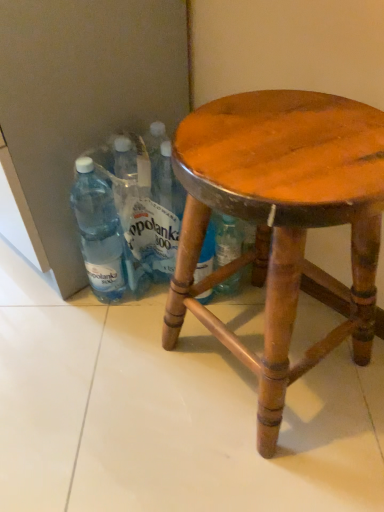
What do you see at coordinates (122, 218) in the screenshot? I see `transparent plastic bottles at lower left` at bounding box center [122, 218].

Measure the distance between wooden stool at center and camera.

They are 16.92 inches apart.

What do you see at coordinates (98, 231) in the screenshot?
I see `transparent plastic bottle at left` at bounding box center [98, 231].

What are the coordinates of `transparent plastic bottles at lower left` in the screenshot? It's located at (122, 218).

Considering the positions of objects transparent plastic bottle at left and wooden stool at center in the image provided, who is more to the left, transparent plastic bottle at left or wooden stool at center?

transparent plastic bottle at left is more to the left.

From a real-world perspective, who is located higher, transparent plastic bottle at left or wooden stool at center?

From a 3D spatial view, wooden stool at center is above.

Based on the photo, can we say transparent plastic bottle at left lies outside wooden stool at center?

Yes, transparent plastic bottle at left is not within wooden stool at center.

Is transparent plastic bottles at lower left outside of transparent plastic bottle at left?

Indeed, transparent plastic bottles at lower left is completely outside transparent plastic bottle at left.

You are a GUI agent. You are given a task and a screenshot of the screen. Output one action in this format:
    pyautogui.click(x=<x>, y=<y>)
    Task: Click on the beverage that appears below the transparent plastic bottle at left (from a real-world perspective)
    The height and width of the screenshot is (512, 384).
    Given the screenshot: What is the action you would take?
    pyautogui.click(x=122, y=218)

Are transparent plastic bottles at lower left and transparent plastic bottle at left beside each other?

Yes.

Is point (116, 145) positioned behind point (87, 205)?

That is False.

From the image's perspective, is wooden stool at center located above or below transparent plastic bottle at left?

From the image's perspective, wooden stool at center appears below transparent plastic bottle at left.

Can you confirm if wooden stool at center is positioned to the left of transparent plastic bottle at left?

Incorrect, wooden stool at center is not on the left side of transparent plastic bottle at left.

Are wooden stool at center and transparent plastic bottle at left located far from each other?

They are positioned close to each other.

How much distance is there between wooden stool at center and transparent plastic bottle at left?

13.17 inches.

Is transparent plastic bottles at lower left wider or thinner than wooden stool at center?

Considering their sizes, transparent plastic bottles at lower left looks slimmer than wooden stool at center.

Considering the relative sizes of transparent plastic bottles at lower left and wooden stool at center in the image provided, is transparent plastic bottles at lower left smaller than wooden stool at center?

Indeed, transparent plastic bottles at lower left has a smaller size compared to wooden stool at center.

In the scene shown: From a real-world perspective, which object stands above the other?

wooden stool at center.

Is transparent plastic bottles at lower left oriented away from wooden stool at center?

transparent plastic bottles at lower left is not turned away from wooden stool at center.

Which point is more distant from viewer, (106, 234) or (90, 204)?

The point (106, 234) is more distant.

Is transparent plastic bottle at left inside or outside of transparent plastic bottles at lower left?

transparent plastic bottle at left lies outside transparent plastic bottles at lower left.

Considering the sizes of objects transparent plastic bottle at left and transparent plastic bottles at lower left in the image provided, who is shorter, transparent plastic bottle at left or transparent plastic bottles at lower left?

With less height is transparent plastic bottle at left.

From a real-world perspective, is transparent plastic bottle at left on top of transparent plastic bottles at lower left?

Yes, from a real-world perspective, transparent plastic bottle at left is above transparent plastic bottles at lower left.

Is wooden stool at center not close to transparent plastic bottles at lower left?

No, there isn't a large distance between wooden stool at center and transparent plastic bottles at lower left.

Can you confirm if wooden stool at center is taller than transparent plastic bottles at lower left?

Yes.

From the image's perspective, between wooden stool at center and transparent plastic bottles at lower left, who is located below?

From the image's view, wooden stool at center is below.

Which object is closer to the camera taking this photo, wooden stool at center or transparent plastic bottles at lower left?

wooden stool at center is more forward.

The width and height of the screenshot is (384, 512). I want to click on stool on the right of the transparent plastic bottle at left, so click(x=282, y=220).

Where is `beverage above the transparent plastic bottle at left (from the image's perspective)`? beverage above the transparent plastic bottle at left (from the image's perspective) is located at coordinates (122, 218).

From the picture: Looking at the image, which one is located closer to transparent plastic bottles at lower left, wooden stool at center or transparent plastic bottle at left?

Among the two, transparent plastic bottle at left is located nearer to transparent plastic bottles at lower left.

Based on their spatial positions, is transparent plastic bottles at lower left or wooden stool at center closer to transparent plastic bottle at left?

transparent plastic bottles at lower left lies closer to transparent plastic bottle at left than the other object.

Based on their spatial positions, is transparent plastic bottle at left or wooden stool at center closer to transparent plastic bottles at lower left?

Among the two, transparent plastic bottle at left is located nearer to transparent plastic bottles at lower left.

Considering their positions, is wooden stool at center positioned further to transparent plastic bottle at left than transparent plastic bottles at lower left?

wooden stool at center is further to transparent plastic bottle at left.

Considering their positions, is transparent plastic bottles at lower left positioned further to wooden stool at center than transparent plastic bottle at left?

Based on the image, transparent plastic bottle at left appears to be further to wooden stool at center.

From the image, which object appears to be farther from wooden stool at center, transparent plastic bottle at left or transparent plastic bottles at lower left?

The object further to wooden stool at center is transparent plastic bottle at left.

You are a GUI agent. You are given a task and a screenshot of the screen. Output one action in this format:
    pyautogui.click(x=<x>, y=<y>)
    Task: Click on the bottle located between wooden stool at center and transparent plastic bottles at lower left in the depth direction
    Image resolution: width=384 pixels, height=512 pixels.
    Given the screenshot: What is the action you would take?
    pyautogui.click(x=98, y=231)